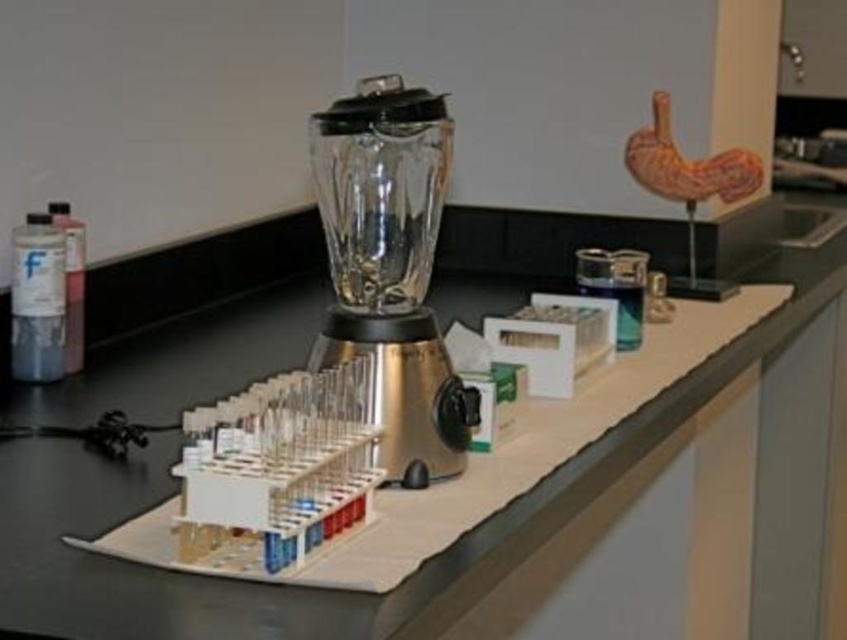
You are a researcher in a lab needing to place a small beaker on the black plastic counter at center and the translucent glass blender at center. Which object should you place it on if you want it closer to the left side of the scene?

The translucent glass blender at center is on the left side of the black plastic counter at center. Since you want the beaker closer to the left side of the scene, place it on the translucent glass blender at center.

You are a researcher in a lab and need to place a new equipment on the black plastic counter at center. Where exactly should you place it?

The black plastic counter at center is located at point (329, 589), so you should place the new equipment at that coordinate.